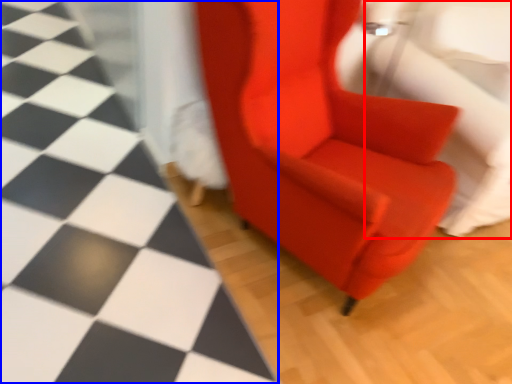
Question: Which point is closer to the camera, swivel chair (highlighted by a red box) or tile (highlighted by a blue box)?

Choices:
 (A) swivel chair
 (B) tile

Answer: (B)